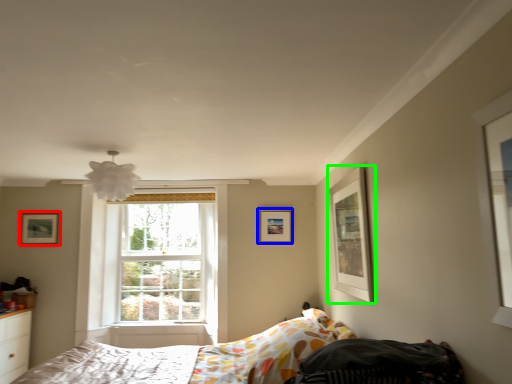
Question: Based on their relative distances, which object is nearer to picture frame (highlighted by a red box)? Choose from picture frame (highlighted by a blue box) and picture frame (highlighted by a green box).

Choices:
 (A) picture frame
 (B) picture frame

Answer: (A)